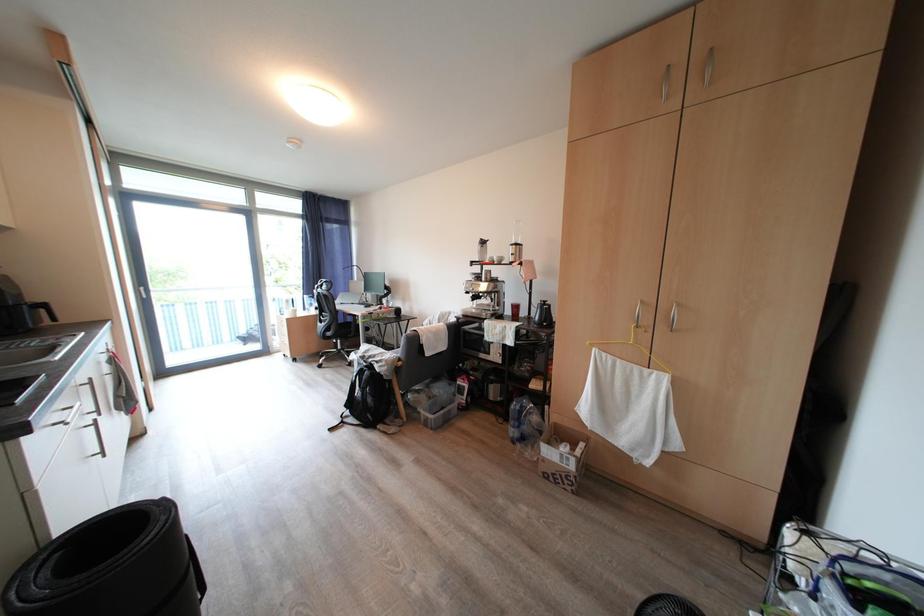
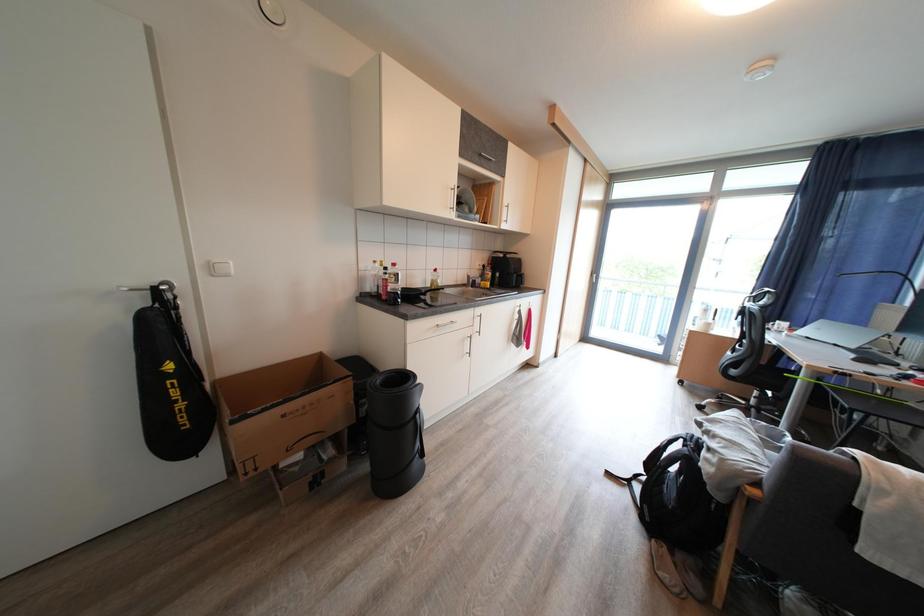
Question: The camera is either moving clockwise (left) or counter-clockwise (right) around the object. The first image is from the beginning of the video and the second image is from the end. Is the camera moving left or right when shooting the video?

Choices:
 (A) Left
 (B) Right

Answer: (B)